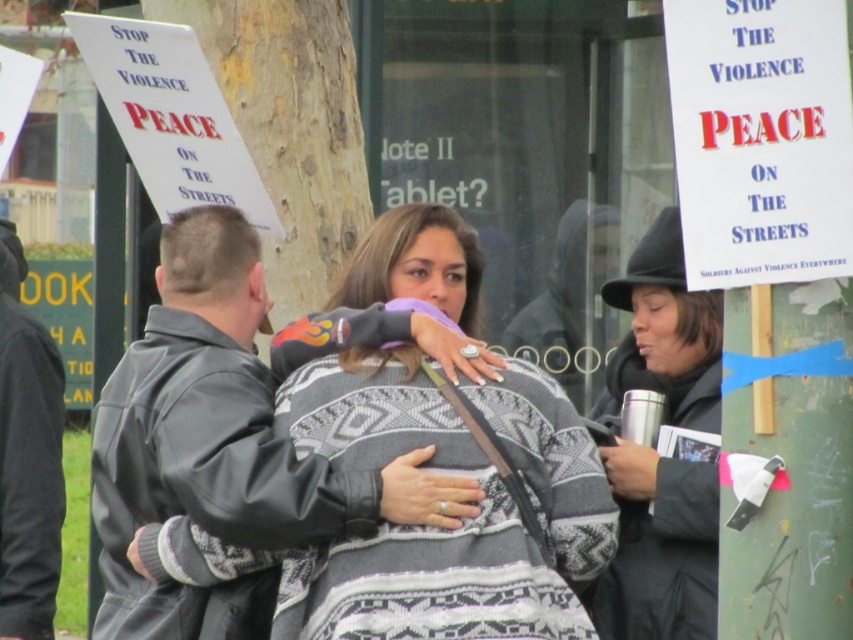
Question: Among these points, which one is nearest to the camera?

Choices:
 (A) (13, 588)
 (B) (641, 250)

Answer: (B)

Question: Can you confirm if leather jacket at center is positioned to the right of black woolen hat at upper right?

Choices:
 (A) no
 (B) yes

Answer: (A)

Question: Can you confirm if leather jacket at center is positioned to the right of black leather jacket at left?

Choices:
 (A) no
 (B) yes

Answer: (B)

Question: Is leather jacket at center thinner than black leather jacket at left?

Choices:
 (A) no
 (B) yes

Answer: (A)

Question: Which point appears farthest from the camera in this image?

Choices:
 (A) (0, 561)
 (B) (181, 483)
 (C) (654, 532)

Answer: (A)

Question: Based on their relative distances, which object is farther from the leather jacket at center?

Choices:
 (A) black leather jacket at left
 (B) black woolen hat at upper right

Answer: (A)